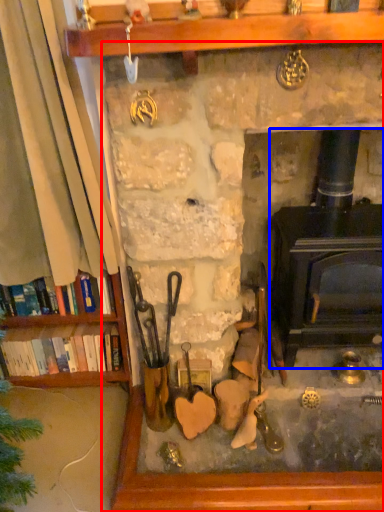
Question: Which object is further to the camera taking this photo, fireplace (highlighted by a red box) or wood burning stove (highlighted by a blue box)?

Choices:
 (A) fireplace
 (B) wood burning stove

Answer: (B)